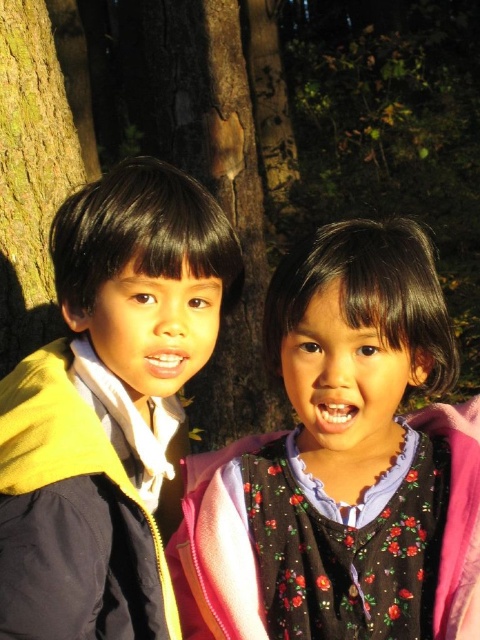
Question: Is floral-patterned dress at center above yellow matte jacket at left?

Choices:
 (A) yes
 (B) no

Answer: (B)

Question: Which object is positioned closest to the floral-patterned dress at center?

Choices:
 (A) yellow matte jacket at left
 (B) green rough bark at left

Answer: (A)

Question: Considering the relative positions of floral-patterned dress at center and yellow matte jacket at left in the image provided, where is floral-patterned dress at center located with respect to yellow matte jacket at left?

Choices:
 (A) left
 (B) right

Answer: (B)

Question: Which object appears farthest from the camera in this image?

Choices:
 (A) floral-patterned dress at center
 (B) yellow matte jacket at left

Answer: (A)

Question: Which point is farther from the camera taking this photo?

Choices:
 (A) (403, 573)
 (B) (26, 282)

Answer: (B)

Question: Can you confirm if floral-patterned dress at center is thinner than yellow matte jacket at left?

Choices:
 (A) no
 (B) yes

Answer: (A)